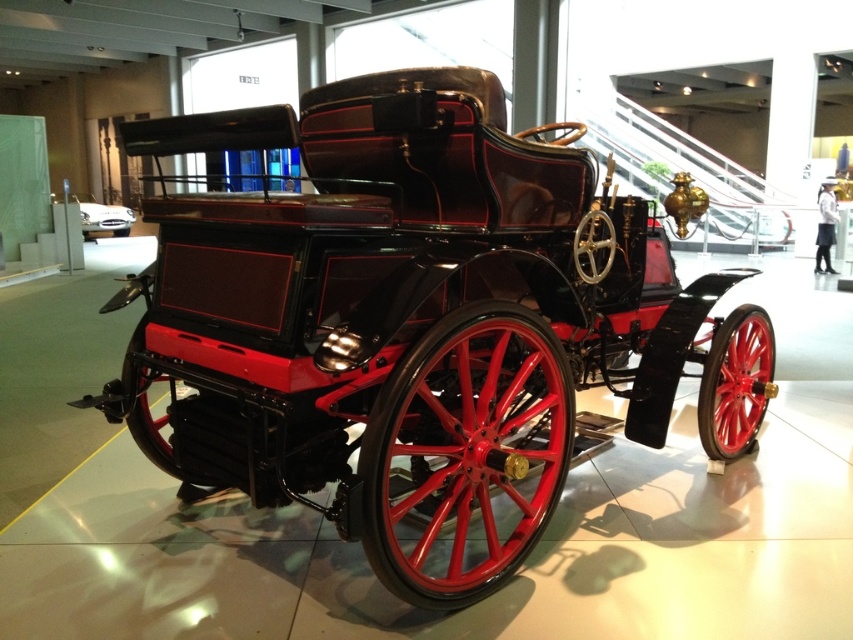
Question: Is shiny black car at center thinner than polished wood coach at center?

Choices:
 (A) yes
 (B) no

Answer: (B)

Question: Estimate the real-world distances between objects in this image. Which object is closer to the shiny black wagon at center?

Choices:
 (A) shiny black car at center
 (B) polished wood coach at center

Answer: (B)

Question: Can you confirm if shiny black wagon at center is positioned above polished wood coach at center?

Choices:
 (A) no
 (B) yes

Answer: (A)

Question: Estimate the real-world distances between objects in this image. Which object is closer to the polished wood coach at center?

Choices:
 (A) shiny black car at center
 (B) shiny black wagon at center

Answer: (B)

Question: Estimate the real-world distances between objects in this image. Which object is farther from the polished wood coach at center?

Choices:
 (A) shiny black wagon at center
 (B) shiny black car at center

Answer: (B)

Question: Does shiny black car at center have a smaller size compared to polished wood coach at center?

Choices:
 (A) no
 (B) yes

Answer: (B)